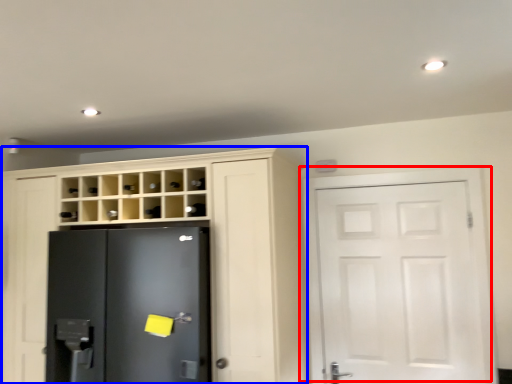
Question: Which object is closer to the camera taking this photo, door (highlighted by a red box) or cupboard (highlighted by a blue box)?

Choices:
 (A) door
 (B) cupboard

Answer: (B)